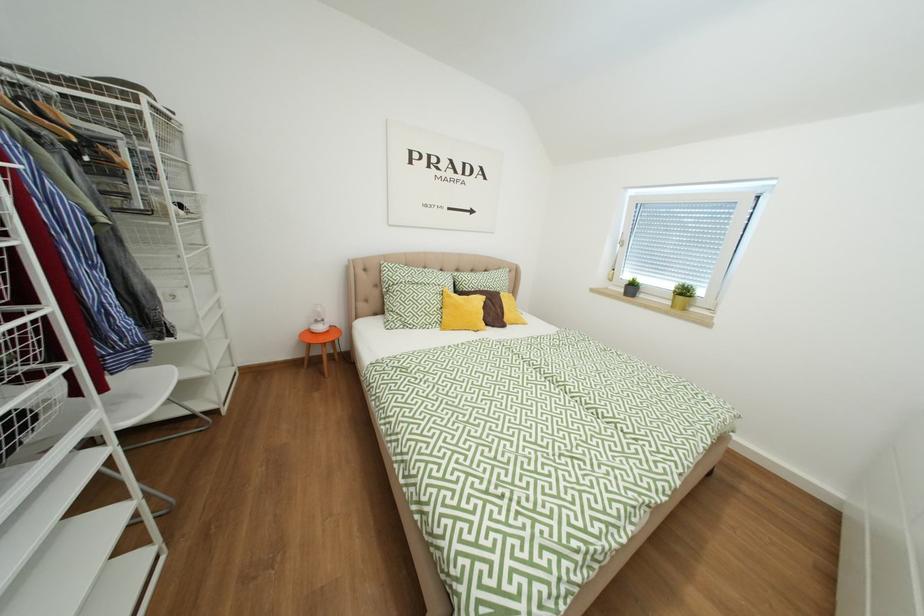
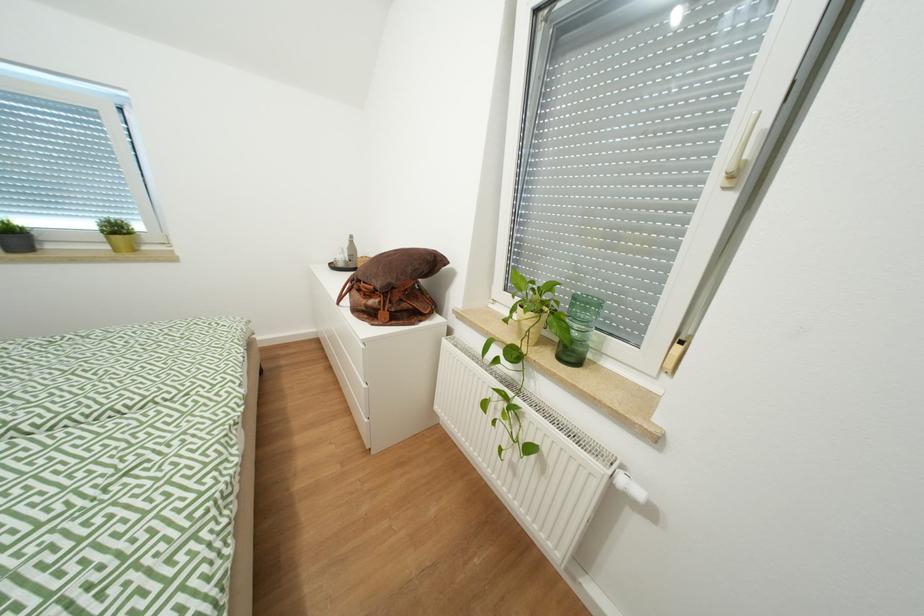
How did the camera likely rotate?

The rotation direction of the camera is right-down.